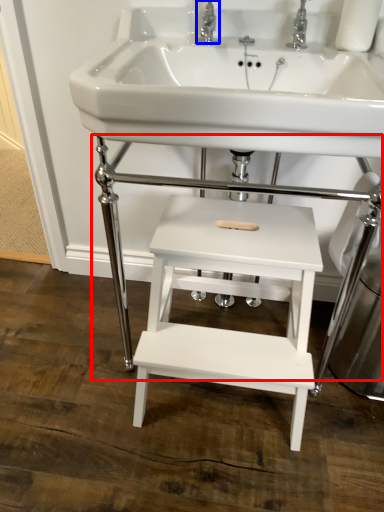
Question: Which of the following is the farthest to the observer, table (highlighted by a red box) or tap (highlighted by a blue box)?

Choices:
 (A) table
 (B) tap

Answer: (B)